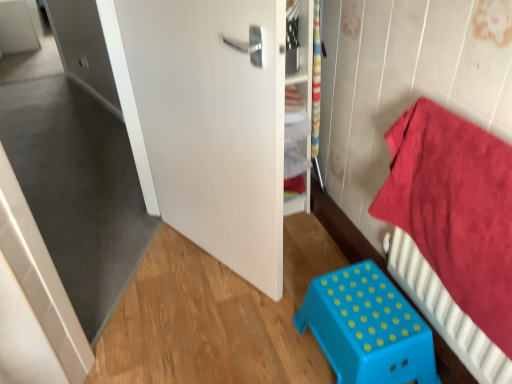
Identify the location of free space above blue plastic stool at lower center (from a real-world perspective). The image size is (512, 384). (367, 307).